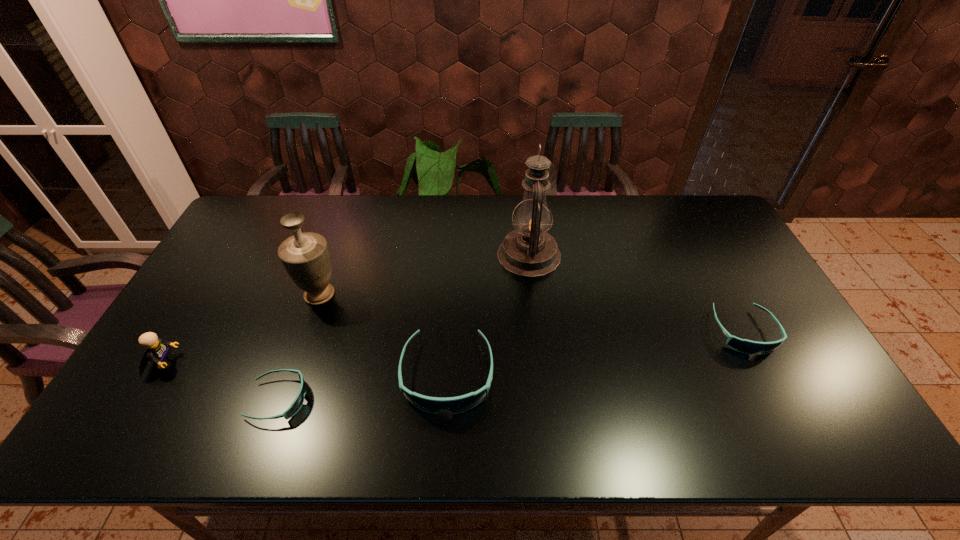
Identify the location of sunglasses that is the second closest one to the rightmost object. The height and width of the screenshot is (540, 960). (298, 402).

Locate an element on the screen. free space that satisfies the following two spatial constraints: 1. on the front-facing side of the rightmost object; 2. on the front-facing side of the leftmost sunglasses is located at coordinates tap(780, 400).

Where is `free space that satisfies the following two spatial constraints: 1. on the front side of the tallest object; 2. on the front-facing side of the leftmost sunglasses`? Image resolution: width=960 pixels, height=540 pixels. free space that satisfies the following two spatial constraints: 1. on the front side of the tallest object; 2. on the front-facing side of the leftmost sunglasses is located at coordinates (546, 400).